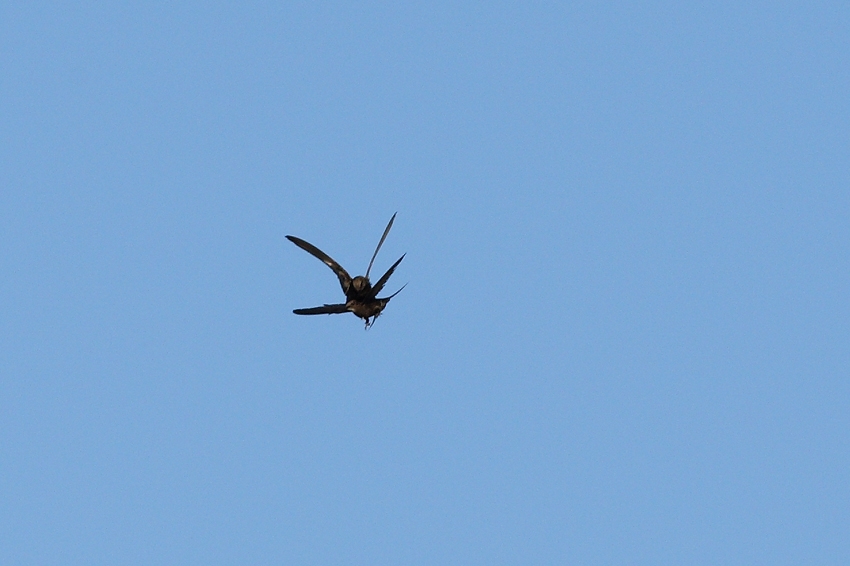
This screenshot has height=566, width=850. Find the location of `chest`. chest is located at coordinates (359, 316).